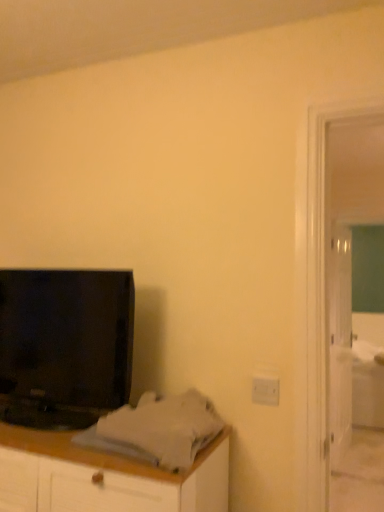
Question: From the image's perspective, relative to green glass screen door at right, is white glossy door at right above or below?

Choices:
 (A) below
 (B) above

Answer: (A)

Question: Would you say white glossy door at right is to the left or to the right of green glass screen door at right in the picture?

Choices:
 (A) right
 (B) left

Answer: (A)

Question: Which object is positioned farthest from the white glossy door at right?

Choices:
 (A) white fabric bed at right
 (B) green glass screen door at right
 (C) black glossy television at left

Answer: (C)

Question: Considering the real-world distances, which object is closest to the white fabric bed at right?

Choices:
 (A) white glossy door at right
 (B) black glossy television at left
 (C) green glass screen door at right

Answer: (A)